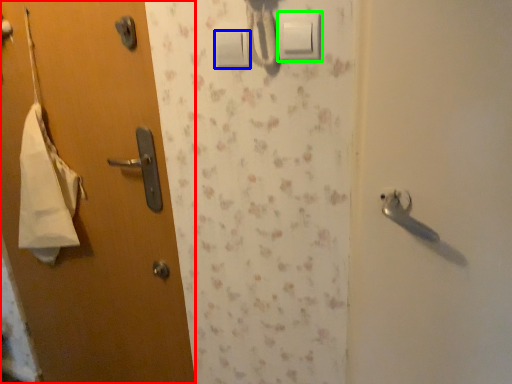
Question: Which object is the closest to the door (highlighted by a red box)? Choose among these: light switch (highlighted by a blue box) or light switch (highlighted by a green box).

Choices:
 (A) light switch
 (B) light switch

Answer: (A)